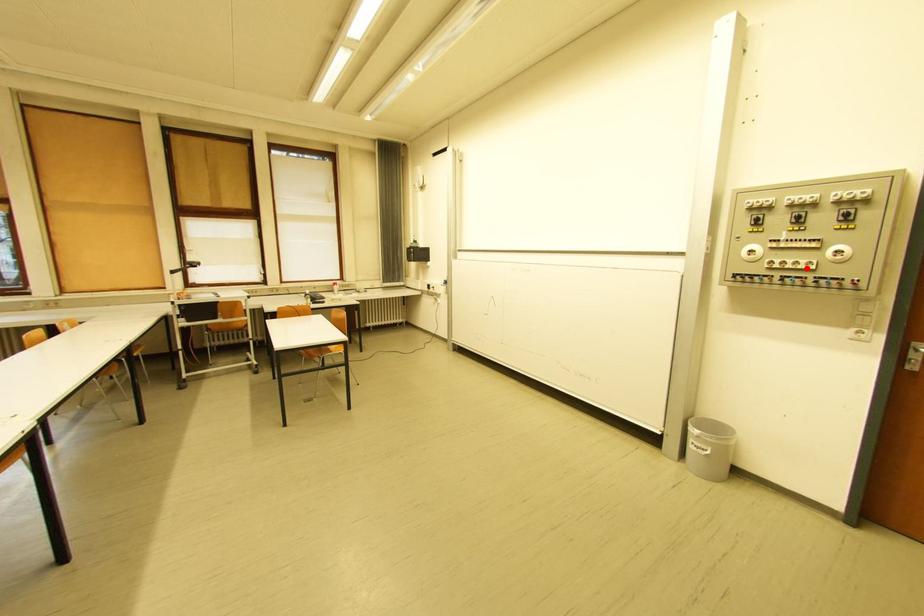
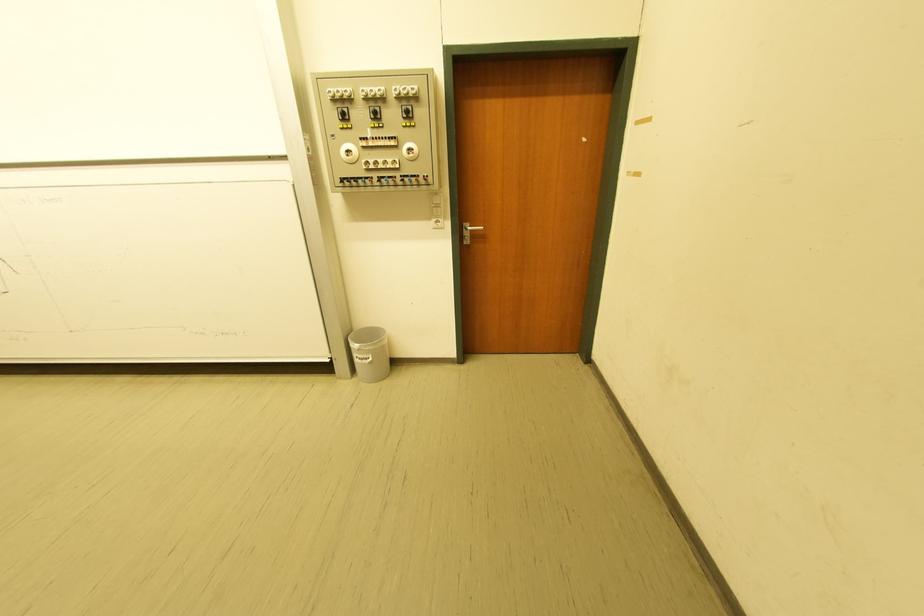
The point at the highlighted location is marked in the first image. Where is the corresponding point in the second image?

(395, 168)